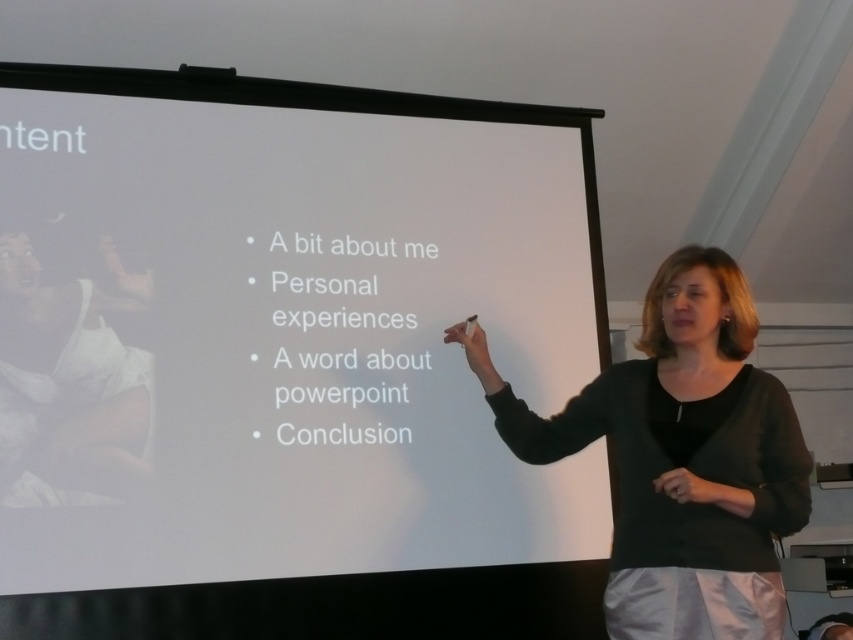
Between point (229, 480) and point (682, 266), which one is positioned behind?

Point (229, 480)

Can you confirm if white matte projection screen at center is taller than black fabric at center?

Correct, white matte projection screen at center is much taller as black fabric at center.

Between point (144, 92) and point (621, 579), which one is positioned behind?

Point (144, 92)

Identify the location of white matte projection screen at center. Image resolution: width=853 pixels, height=640 pixels. (282, 328).